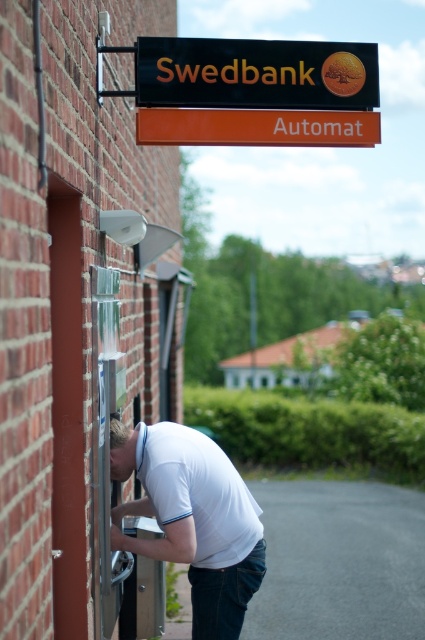
You are standing in front of the Swedbank ATM and notice the white matte shirt at center and the black plastic sign at upper center. Which object is nearer to you?

The white matte shirt at center is closer to the viewer than the black plastic sign at upper center.

You are a fashion designer observing the scene outside the brick building. You notice the white matte shirt at center and the black plastic sign at upper center. Which object has a smaller width?

The white matte shirt at center has a smaller width than the black plastic sign at upper center.

You are a fashion designer observing the scene outside the Swedbank ATM. You notice the white matte shirt at center and the orange plastic sign at upper center. Which object has a smaller width?

The white matte shirt at center is thinner than the orange plastic sign at upper center, so the white matte shirt at center has a smaller width.